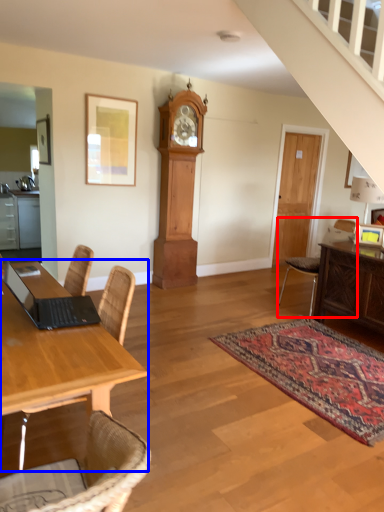
Question: Which object is closer to the camera taking this photo, chair (highlighted by a red box) or desk (highlighted by a blue box)?

Choices:
 (A) chair
 (B) desk

Answer: (B)